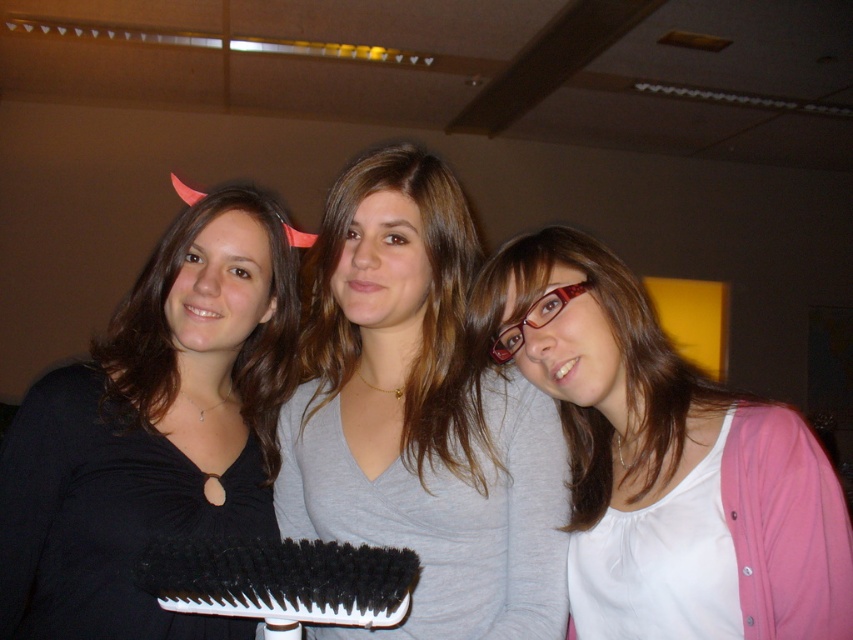
Question: Which object is the farthest from the gray matte shirt at center?

Choices:
 (A) black matte brush at left
 (B) brownsmoothhair at center
 (C) black bristle brush at center

Answer: (C)

Question: Which of the following is the closest to the observer?

Choices:
 (A) (206, 541)
 (B) (248, 195)
 (C) (323, 352)

Answer: (A)

Question: Is gray matte shirt at center smaller than brownsmoothhair at center?

Choices:
 (A) no
 (B) yes

Answer: (A)

Question: Can you confirm if pink fabric at center is wider than brownsmoothhair at center?

Choices:
 (A) no
 (B) yes

Answer: (B)

Question: Does pink fabric at center lie in front of black bristle brush at center?

Choices:
 (A) no
 (B) yes

Answer: (A)

Question: Based on their relative distances, which object is farther from the gray matte shirt at center?

Choices:
 (A) black matte brush at left
 (B) black bristle brush at center
 (C) pink fabric at center

Answer: (B)